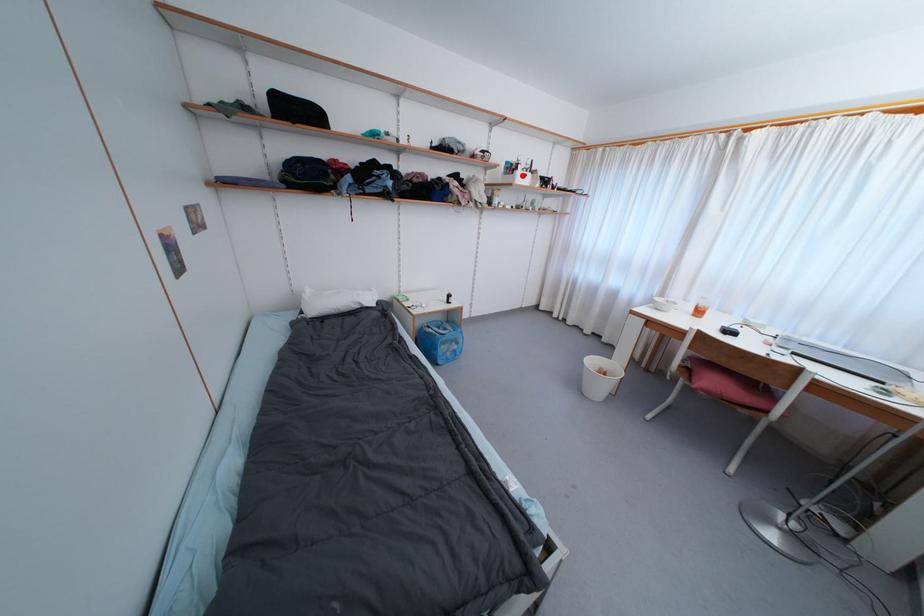
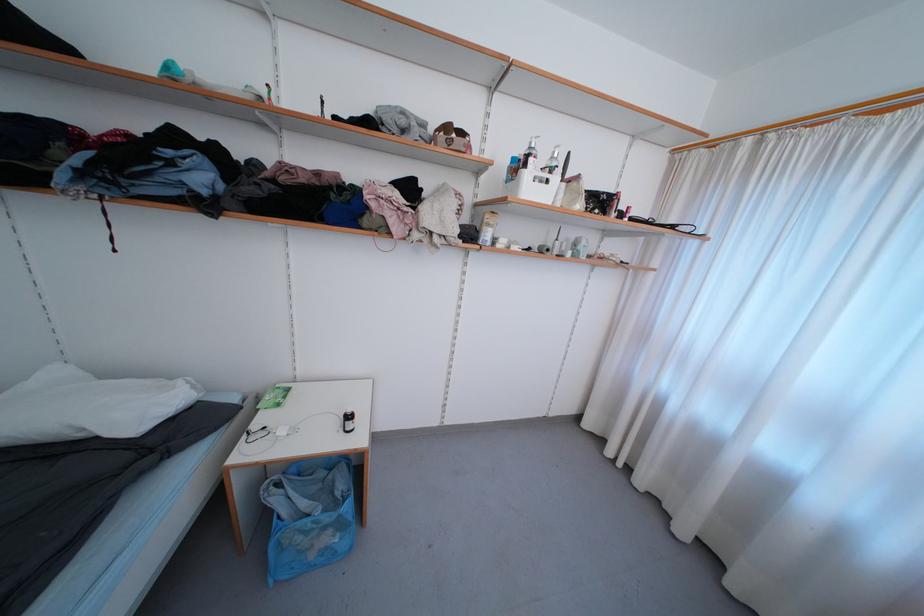
The point at the highlighted location is marked in the first image. Where is the corresponding point in the second image?

(531, 177)